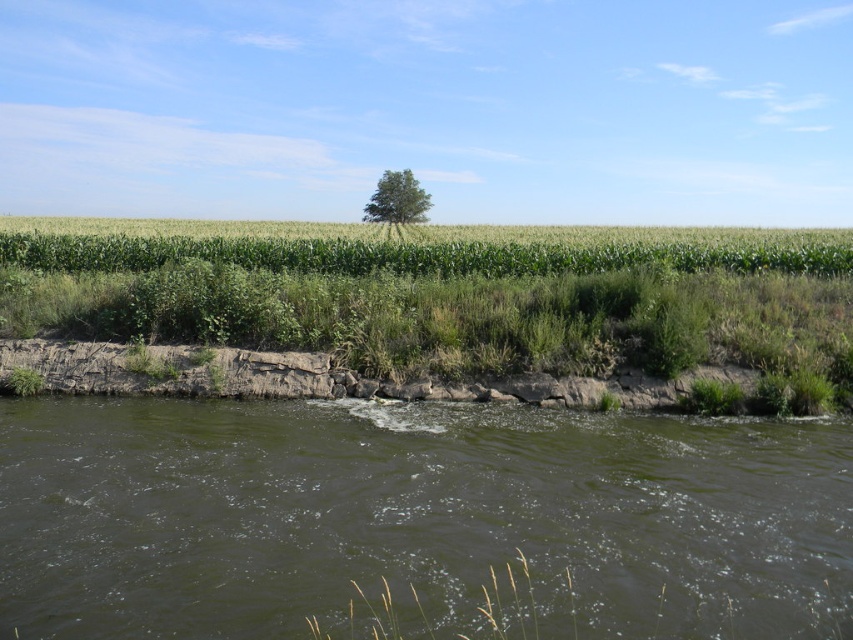
Is green grassy field at center closer to the viewer compared to green leafy tree at center?

Yes, green grassy field at center is in front of green leafy tree at center.

Is point (718, 264) positioned in front of point (401, 172)?

Yes.

Who is more forward, (788, 269) or (392, 186)?

Point (788, 269)

Image resolution: width=853 pixels, height=640 pixels. In order to click on green grassy field at center in this screenshot , I will do `click(434, 316)`.

Which is behind, point (521, 541) or point (74, 387)?

Positioned behind is point (74, 387).

From the picture: Can you confirm if dark green water at lower center is positioned to the right of green grassy field at center?

Correct, you'll find dark green water at lower center to the right of green grassy field at center.

Between point (148, 566) and point (850, 248), which one is positioned behind?

The point (850, 248) is behind.

In order to click on dark green water at lower center in this screenshot , I will do `click(413, 515)`.

Which is below, dark green water at lower center or green leafy tree at center?

dark green water at lower center is lower down.

Is dark green water at lower center further to the viewer compared to green leafy tree at center?

No, it is in front of green leafy tree at center.

Locate an element on the screen. dark green water at lower center is located at coordinates (413, 515).

The height and width of the screenshot is (640, 853). Identify the location of dark green water at lower center. (413, 515).